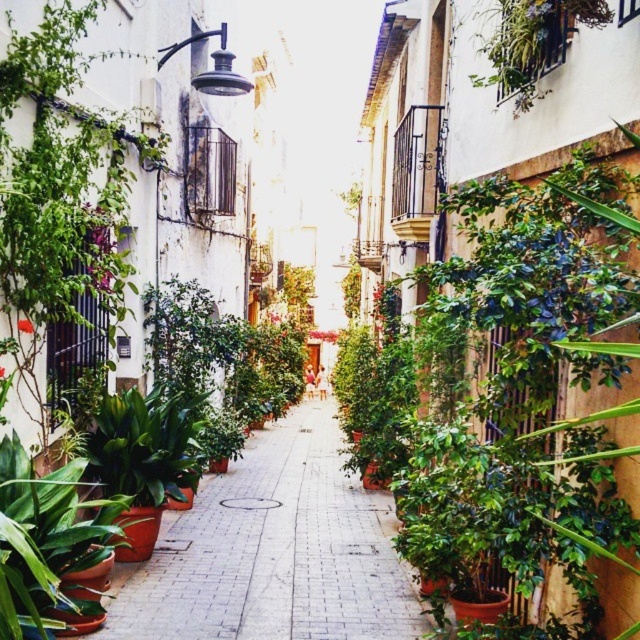
You are a delivery person carrying a box and need to walk through the narrow alleyway. You see the brick pavement at center and the green glossy leafy plant at lower left. Which of these two objects is shorter in height?

The brick pavement at center is shorter in height compared to the green glossy leafy plant at lower left according to the description.

You are a delivery person standing at the entrance of the alleyway. You need to place a package on the brick pavement at center. Where should you walk to place it?

The brick pavement at center is located at the coordinates point (273, 552), so you should walk towards that point to place the package there.